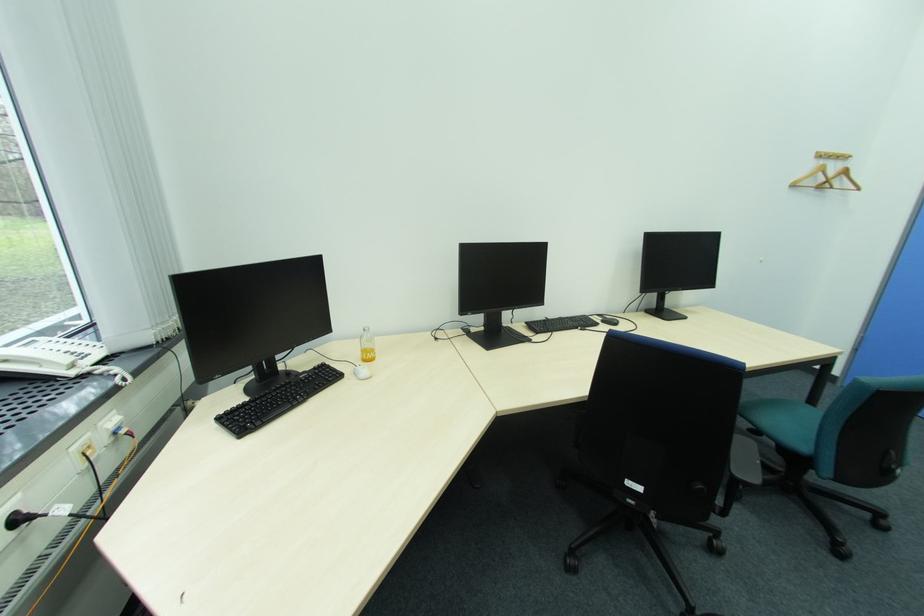
Find the location of a particular element. white computer mouse is located at coordinates (361, 371).